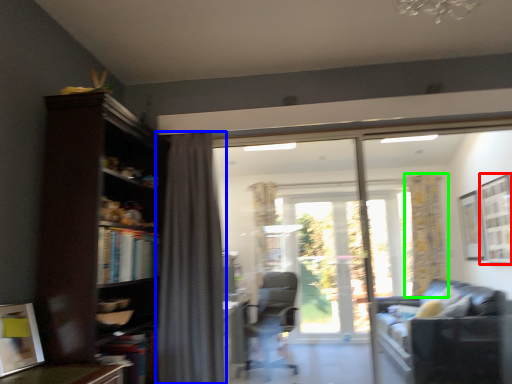
Question: Which object is positioned closest to window (highlighted by a red box)? Select from curtain (highlighted by a blue box) and curtain (highlighted by a green box).

Choices:
 (A) curtain
 (B) curtain

Answer: (B)